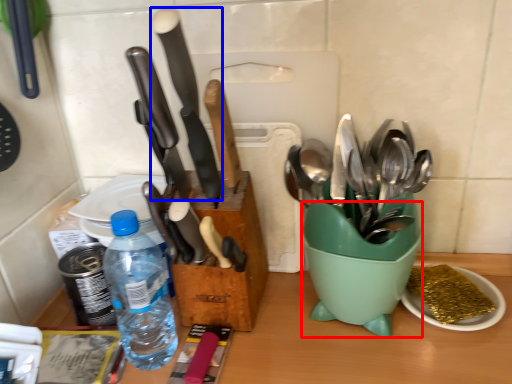
Question: Among these objects, which one is farthest to the camera, mixing bowl (highlighted by a red box) or kitchen knife (highlighted by a blue box)?

Choices:
 (A) mixing bowl
 (B) kitchen knife

Answer: (A)